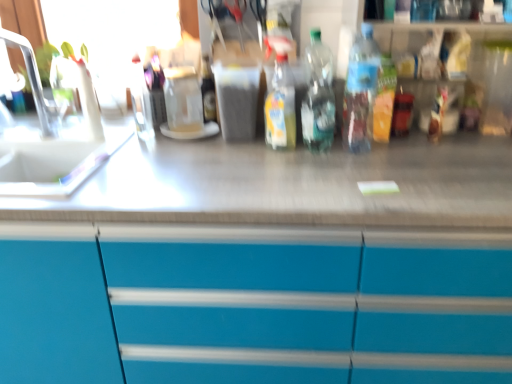
The image size is (512, 384). In order to click on free point to the left of translucent plastic bottle at center, which is the 2th bottle from left to right in this screenshot , I will do `click(226, 152)`.